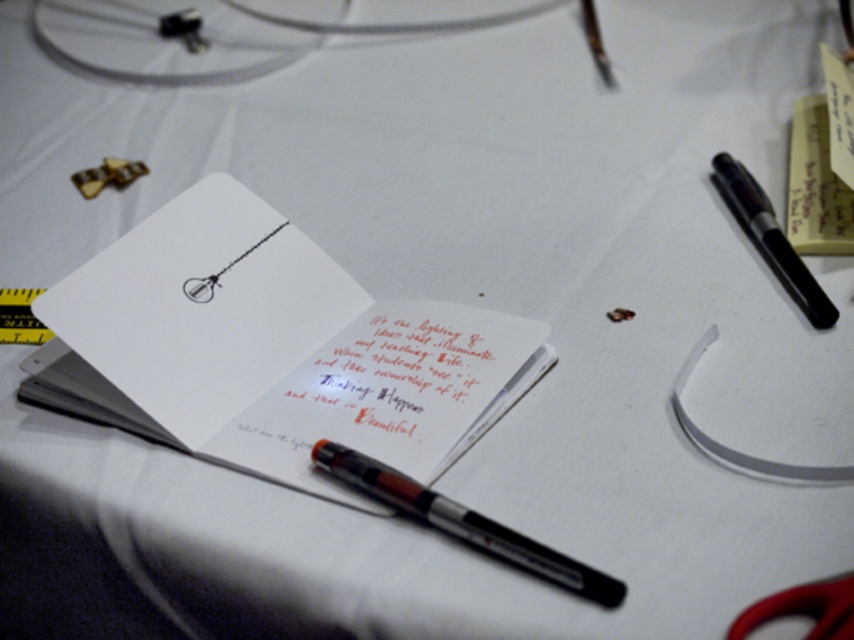
Who is more forward, (787, 211) or (753, 230)?

Point (753, 230)

Is point (806, 102) positioned after point (724, 195)?

That is True.

The height and width of the screenshot is (640, 854). In order to click on yellow paper at upper right in this screenshot , I will do `click(816, 186)`.

Can you confirm if white paper notepad at center is thinner than handwritten paper at center?

No.

Does white paper notepad at center appear over handwritten paper at center?

Yes, white paper notepad at center is above handwritten paper at center.

Who is more forward, (214, 220) or (377, 412)?

Point (377, 412)

This screenshot has width=854, height=640. In order to click on white paper notepad at center in this screenshot , I will do `click(278, 344)`.

Where is `white paper notepad at center`? The image size is (854, 640). white paper notepad at center is located at coordinates (278, 344).

At what (x,y) coordinates should I click in order to perform the action: click on white paper notepad at center. Please return your answer as a coordinate pair (x, y). Looking at the image, I should click on (278, 344).